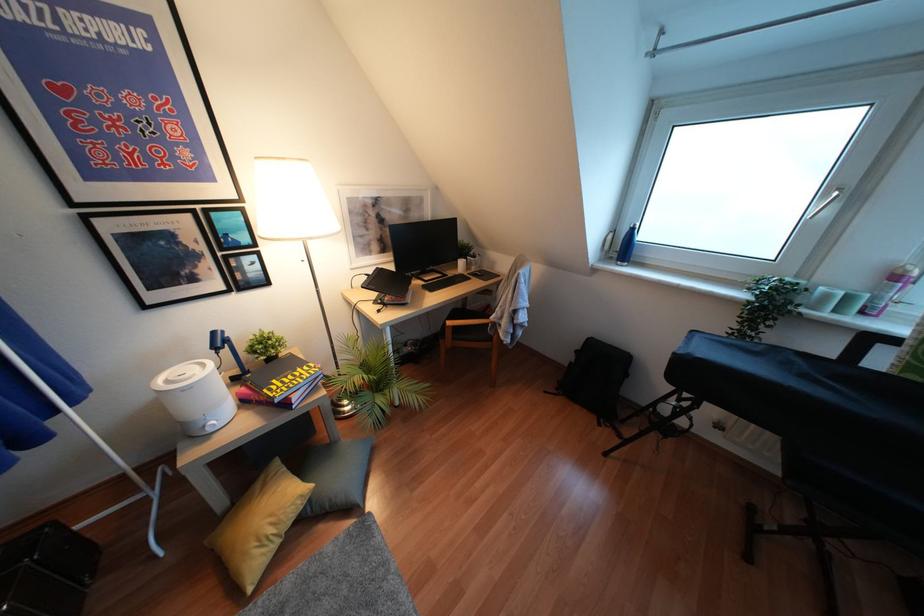
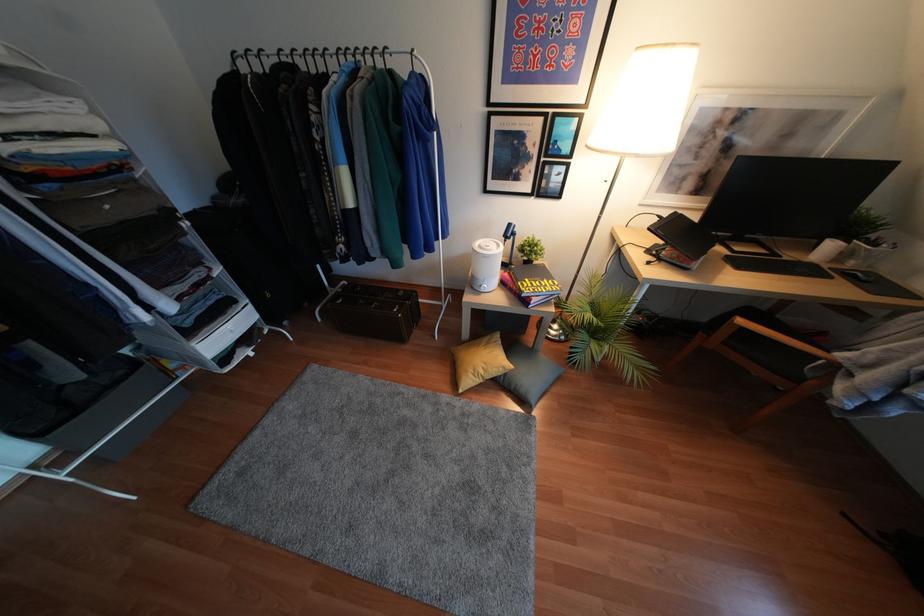
Locate, in the second image, the point that corresponds to point 481,274 in the first image.

(868, 281)